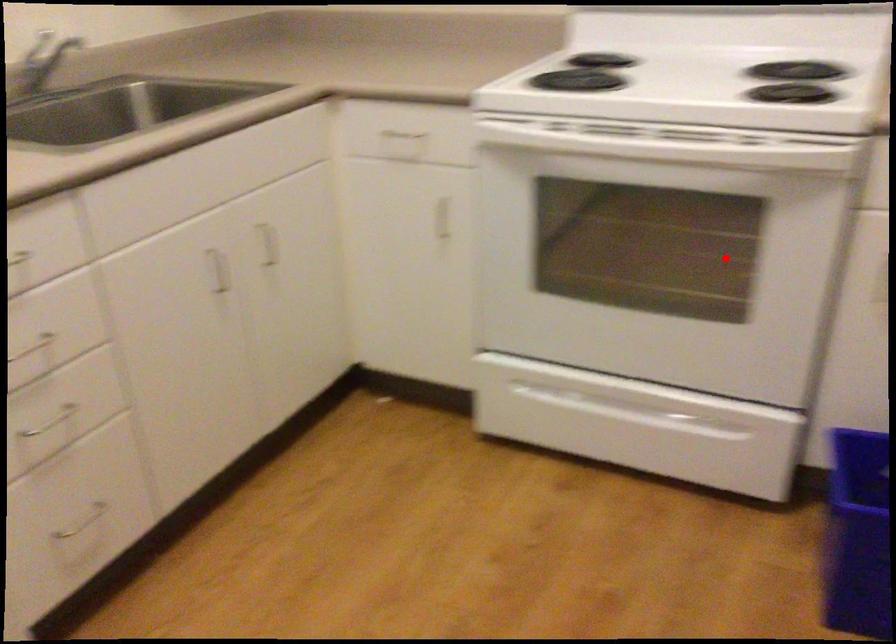
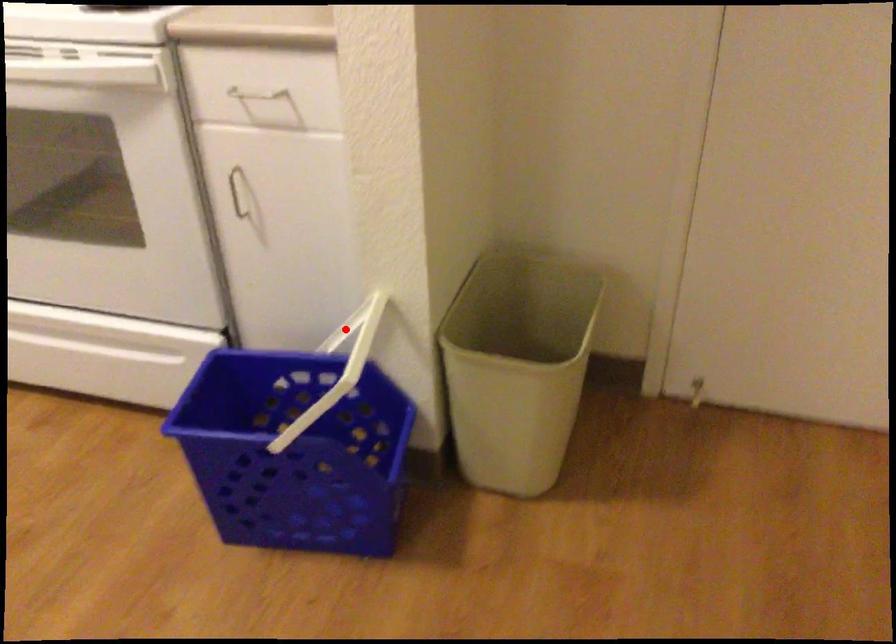
I am providing you with two images of the same scene from different viewpoints. A red point is marked on the first image and another point is marked on the second image. Do the highlighted points in image1 and image2 indicate the same real-world spot?

No